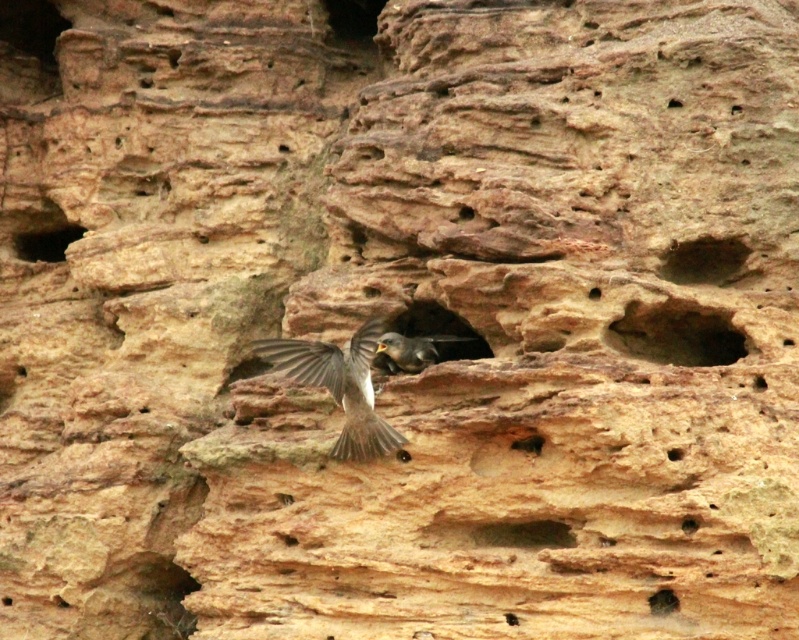
Is smooth brown rock at center right bigger than smooth rock hole at upper right?

Actually, smooth brown rock at center right might be smaller than smooth rock hole at upper right.

Is point (635, 337) more distant than point (733, 262)?

No, it is in front of (733, 262).

Is point (718, 355) in front of point (726, 268)?

Yes.

Where is `smooth brown rock at center right`? smooth brown rock at center right is located at coordinates (676, 333).

Between point (52, 259) and point (654, 602), which one is positioned in front?

Positioned in front is point (654, 602).

Does point (56, 248) come farther from viewer compared to point (656, 605)?

Yes.

The image size is (799, 640). What do you see at coordinates (46, 243) in the screenshot?
I see `smooth rock hole at upper left` at bounding box center [46, 243].

Find the location of `smooth rock hole at upper left`. smooth rock hole at upper left is located at coordinates click(46, 243).

Is point (360, 349) closer to viewer compared to point (698, 257)?

Yes, it is in front of point (698, 257).

Between brown speckled feathers at center and smooth rock hole at upper right, which one has more height?

brown speckled feathers at center is taller.

Is point (364, 388) positioned after point (664, 256)?

Yes, it is behind point (664, 256).

Find the location of a particular element. brown speckled feathers at center is located at coordinates (340, 385).